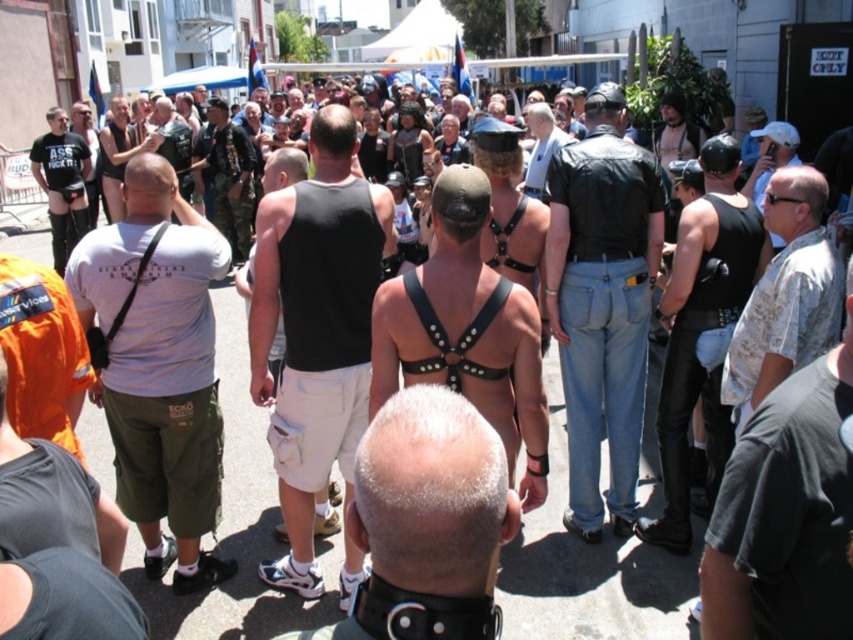
Looking at this image, is black matte tank top at center thinner than orange cotton t-shirt at left?

No, black matte tank top at center is not thinner than orange cotton t-shirt at left.

Is black matte tank top at center to the right of orange cotton t-shirt at left from the viewer's perspective?

Indeed, black matte tank top at center is positioned on the right side of orange cotton t-shirt at left.

Locate an element on the screen. The image size is (853, 640). black matte tank top at center is located at coordinates (316, 330).

Is white matte shorts at center thinner than camouflage jacket at center?

Yes, white matte shorts at center is thinner than camouflage jacket at center.

Can you confirm if white matte shorts at center is positioned to the left of camouflage jacket at center?

Incorrect, white matte shorts at center is not on the left side of camouflage jacket at center.

Between point (392, 538) and point (230, 163), which one is positioned in front?

Point (392, 538)

Locate an element on the screen. This screenshot has width=853, height=640. white matte shorts at center is located at coordinates (431, 496).

Can you confirm if gray cotton t-shirt at center is wider than matte black t-shirt at left?

Incorrect, gray cotton t-shirt at center's width does not surpass matte black t-shirt at left's.

Which of these two, gray cotton t-shirt at center or matte black t-shirt at left, stands taller?

matte black t-shirt at left

Is point (844, 385) closer to camera compared to point (78, 220)?

Yes, it is.

The image size is (853, 640). What are the coordinates of `gray cotton t-shirt at center` in the screenshot? It's located at (786, 512).